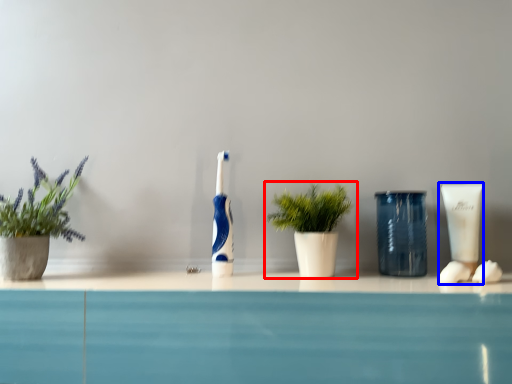
Question: Which object is further to the camera taking this photo, houseplant (highlighted by a red box) or toiletry (highlighted by a blue box)?

Choices:
 (A) houseplant
 (B) toiletry

Answer: (B)